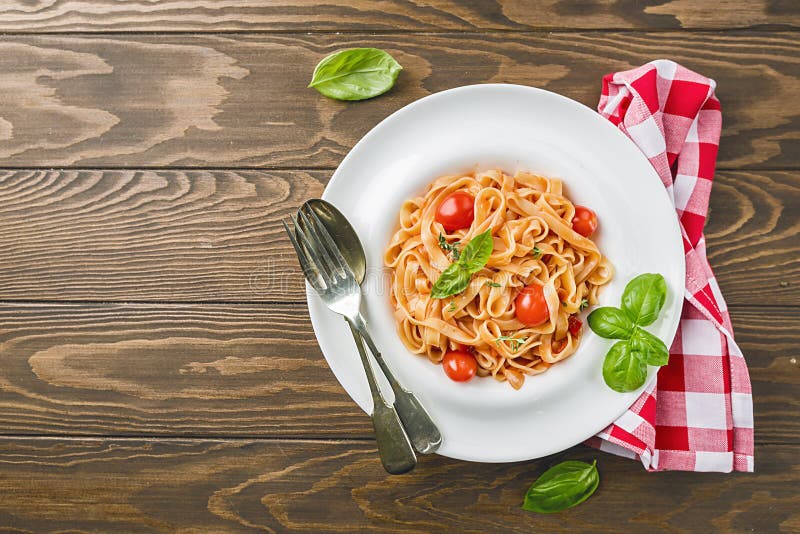
Find the location of `napkin`. napkin is located at coordinates (680, 390).